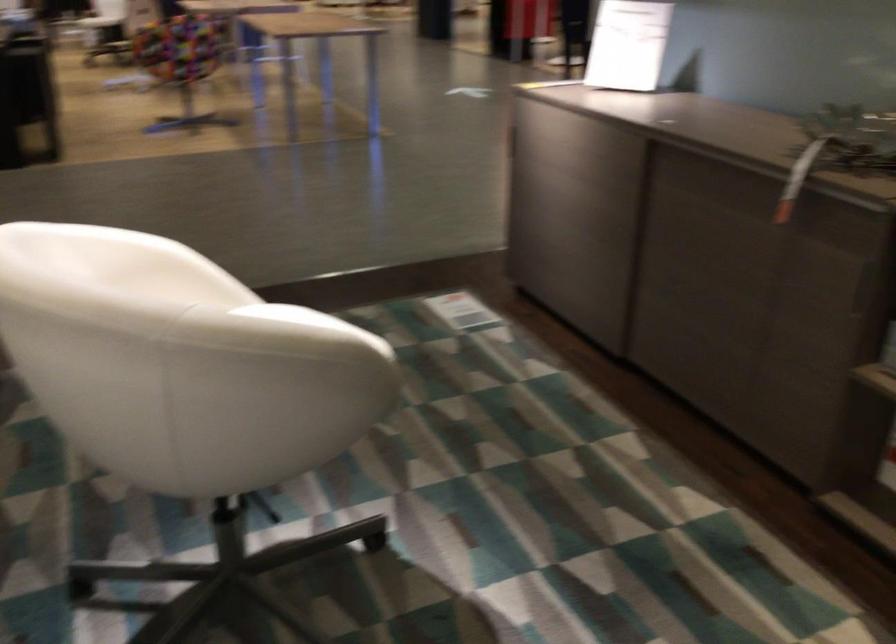
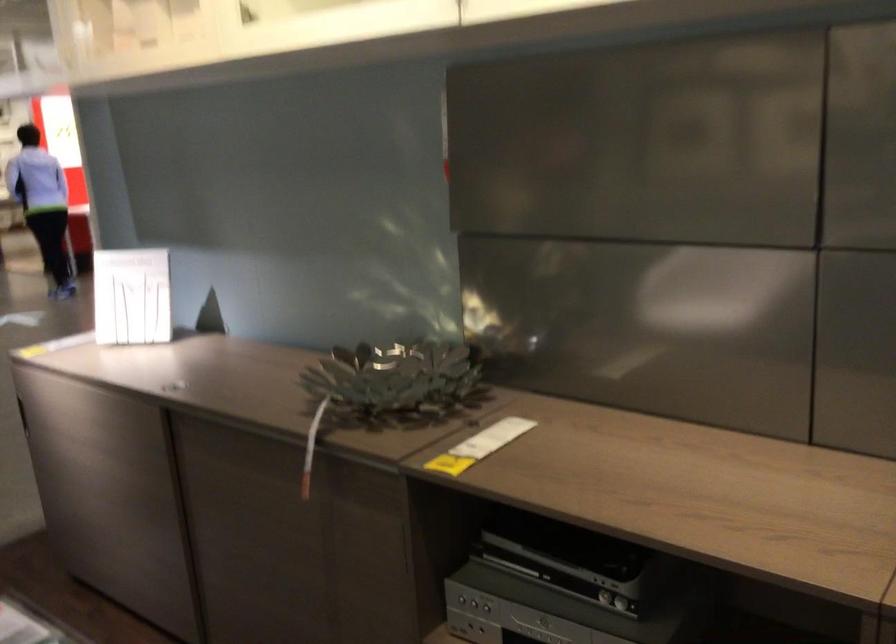
Question: The images are taken continuously from a first-person perspective. In which direction is your viewpoint rotating?

Choices:
 (A) Left
 (B) Right
 (C) Up
 (D) Down

Answer: (B)